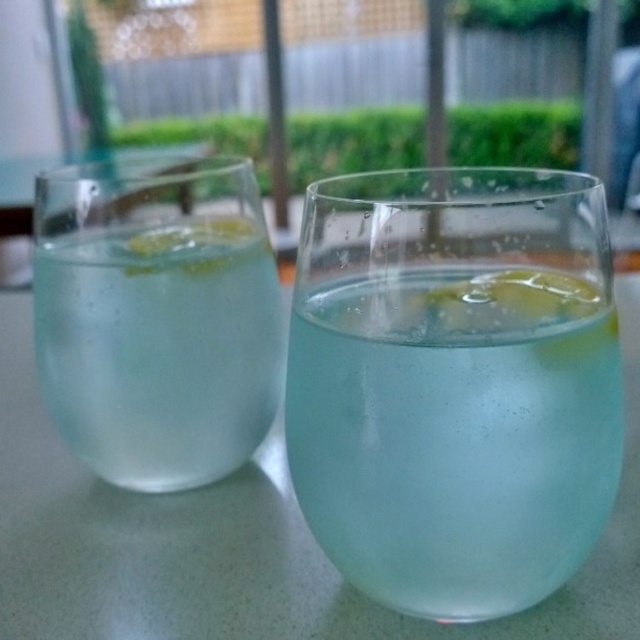
Can you confirm if clear glass at center is positioned below clear glass at left?

Incorrect, clear glass at center is not positioned below clear glass at left.

Is clear glass at center wider than clear glass at left?

Correct, the width of clear glass at center exceeds that of clear glass at left.

What do you see at coordinates (454, 381) in the screenshot? The width and height of the screenshot is (640, 640). I see `clear glass at center` at bounding box center [454, 381].

Locate an element on the screen. clear glass at center is located at coordinates (454, 381).

Between point (202, 518) and point (80, 435), which one is positioned behind?

Positioned behind is point (80, 435).

Where is `transparent glass at center`? transparent glass at center is located at coordinates (237, 538).

From the picture: Can you confirm if clear glass at center is thinner than transparent glass at center?

Yes.

Can you confirm if clear glass at center is bigger than transparent glass at center?

Incorrect, clear glass at center is not larger than transparent glass at center.

Is point (458, 228) farther from camera compared to point (268, 564)?

No, (458, 228) is in front of (268, 564).

Find the location of a particular element. The height and width of the screenshot is (640, 640). clear glass at center is located at coordinates (454, 381).